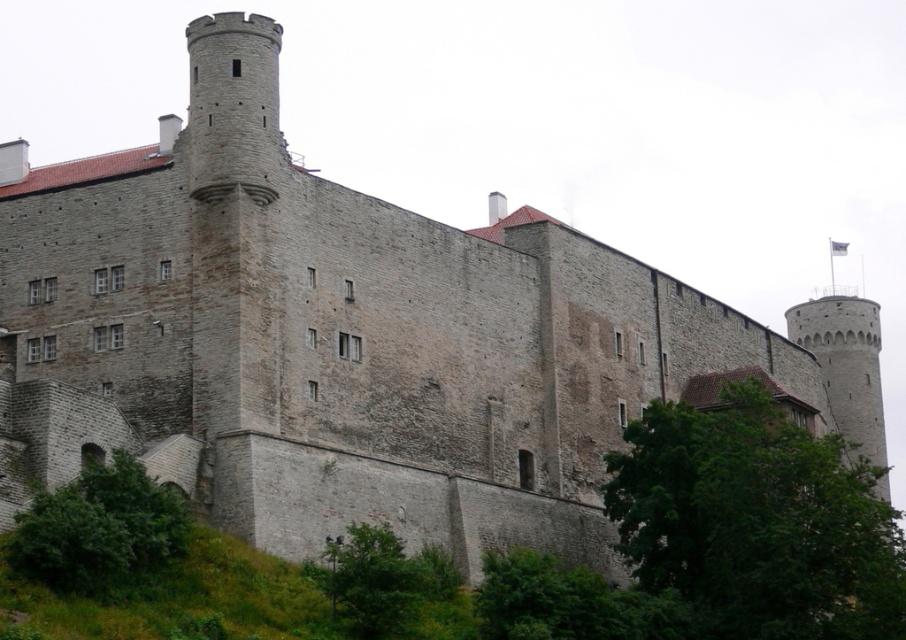
You are standing in front of the historic stone building and want to walk towards the green leafy tree at lower right and the green leafy tree at lower center. Which tree should you approach first to reach the one closer to you?

You should approach the green leafy tree at lower right first because it is closer to you than the green leafy tree at lower center.

You are standing in front of the historic stone building and notice a specific point marked at coordinates (757, 522). Based on the scene description, where would this point be located?

The point at (757, 522) is on the green leafy tree at lower right.

You are standing in front of the historic stone building and want to walk towards the green leafy tree at lower center. Which direction should you move relative to the green leafy bush at lower left?

Since the green leafy bush at lower left is to the left of the green leafy tree at lower center, you should move to the right relative to the green leafy bush at lower left to reach the green leafy tree at lower center.